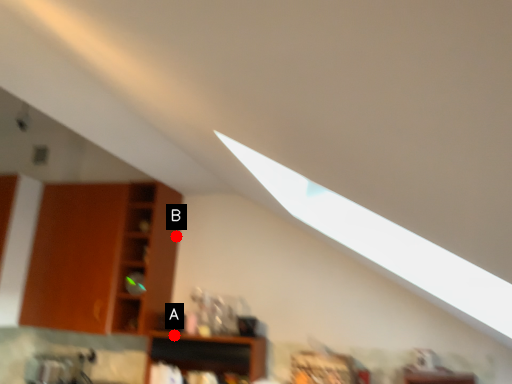
Question: Two points are circled on the image, labeled by A and B beside each circle. Which point is closer to the camera?

Choices:
 (A) A is closer
 (B) B is closer

Answer: (A)